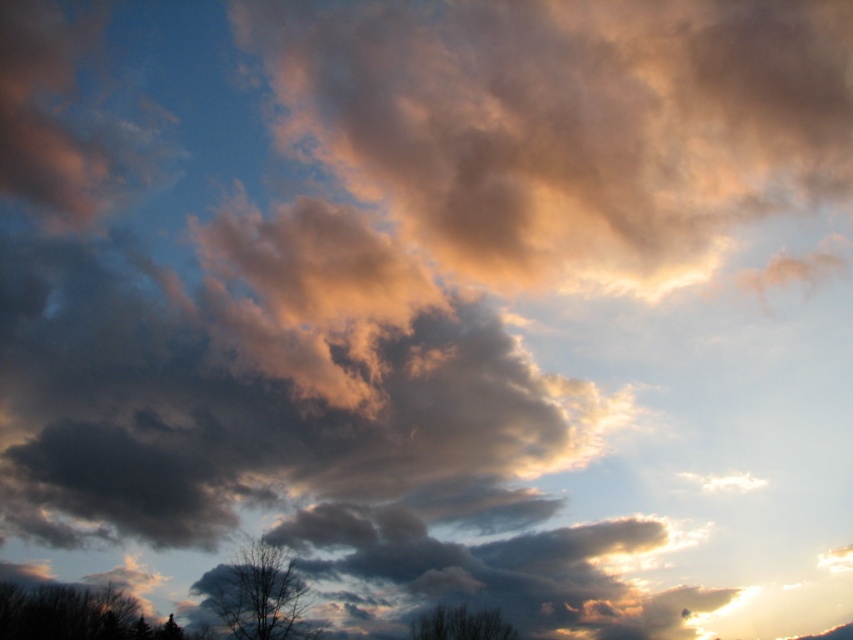
You are an artist trying to paint the scene. You want to ensure the golden textured cloud at upper center and the dark brown textured tree at lower left are proportionally accurate. Which object should you make larger in your painting?

The golden textured cloud at upper center should be made larger in the painting since it is bigger than the dark brown textured tree at lower left according to the description.

You are an astronomer analyzing the image of the sky. You notice a silhouette bare tree at lower left. Based on the position of the sun in the scene, can you determine whether the tree is facing east or west? Please explain your reasoning.

The silhouette bare tree at lower left is positioned at point (74, 614). Since the sun is low on the horizon during sunrise or sunset, the tree would cast a shadow pointing away from the sun. If the sun is in the east during sunrise, the shadow would point west, meaning the tree faces east. Conversely, if the sun is in the west during sunset, the shadow would point east, meaning the tree faces west. However, without knowing the exact time of day, we can only infer the direction based on shadow direction.

You are an astronomer analyzing this sky scene. You notice two points in the image, one at coordinate point (663, 45) and another at point (254, 570). Based on their positions, which point is closer to you?

Point (663, 45) is further to the viewer than point (254, 570), so the point closer to you is point (254, 570).